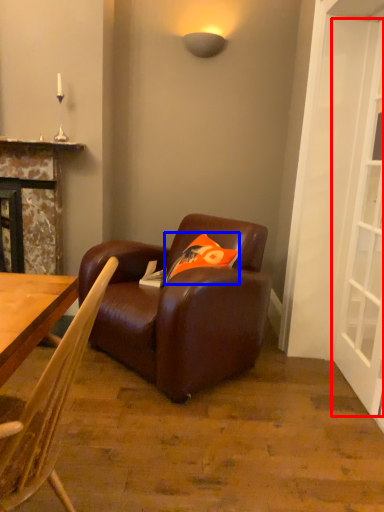
Question: Which object appears closest to the camera in this image, screen door (highlighted by a red box) or pillow (highlighted by a blue box)?

Choices:
 (A) screen door
 (B) pillow

Answer: (A)